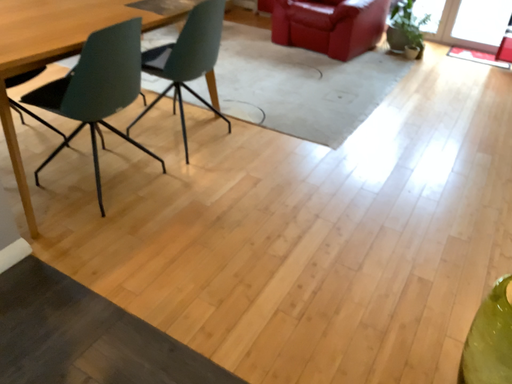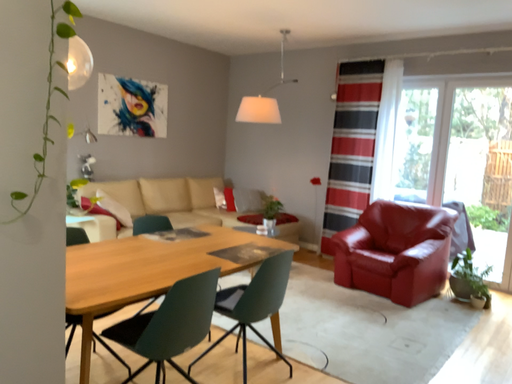
Question: How did the camera likely rotate when shooting the video?

Choices:
 (A) rotated downward
 (B) rotated upward

Answer: (B)